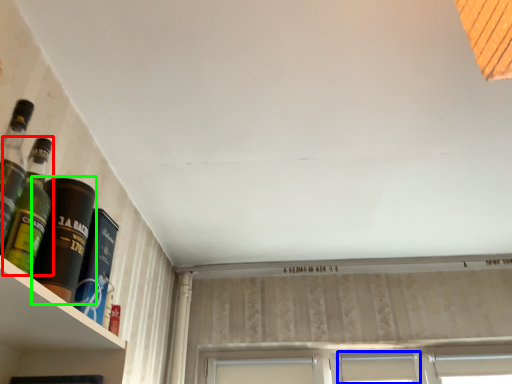
Question: Considering the real-world distances, which object is farthest from bottle (highlighted by a red box)? window (highlighted by a blue box) or bottle (highlighted by a green box)?

Choices:
 (A) window
 (B) bottle

Answer: (A)